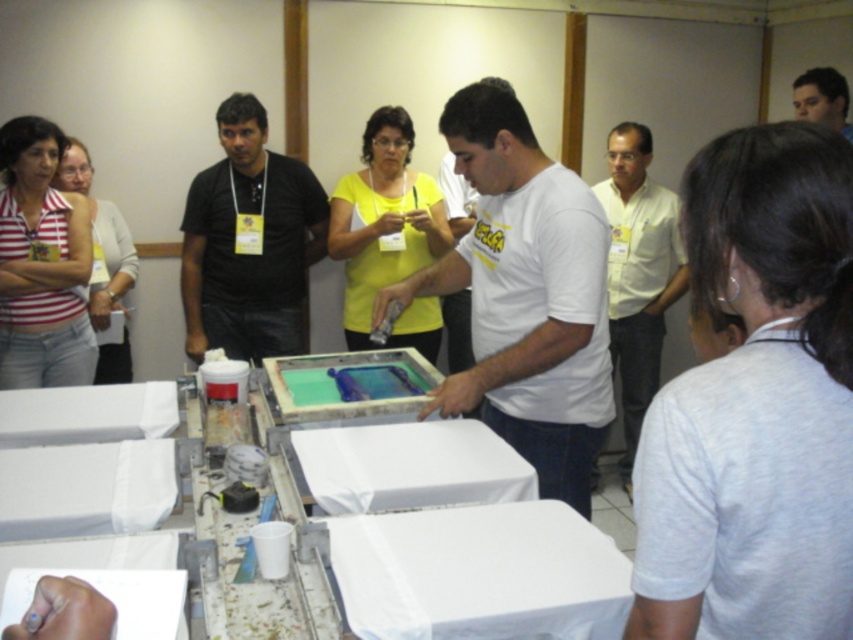
Is white matte t-shirt at center positioned at the back of white shirt at center?

No, white matte t-shirt at center is in front of white shirt at center.

Does white matte t-shirt at center have a larger size compared to white shirt at center?

No.

Locate an element on the screen. The image size is (853, 640). white matte t-shirt at center is located at coordinates (525, 296).

You are a GUI agent. You are given a task and a screenshot of the screen. Output one action in this format:
    pyautogui.click(x=<x>, y=<y>)
    Task: Click on the white matte t-shirt at center
    The width and height of the screenshot is (853, 640).
    Given the screenshot: What is the action you would take?
    pyautogui.click(x=525, y=296)

Is point (306, 397) in front of point (834, 108)?

Yes, point (306, 397) is closer to viewer.

Between translucent plastic tray at center and smooth skin face at upper right, which one appears on the right side from the viewer's perspective?

smooth skin face at upper right

At what (x,y) coordinates should I click in order to perform the action: click on translucent plastic tray at center. Please return your answer as a coordinate pair (x, y). Looking at the image, I should click on (352, 384).

Between point (305, 257) and point (447, 516), which one is positioned in front?

Positioned in front is point (447, 516).

Is black matte shirt at center shorter than white paper at center?

No.

What do you see at coordinates (248, 243) in the screenshot? I see `black matte shirt at center` at bounding box center [248, 243].

Locate an element on the screen. black matte shirt at center is located at coordinates (248, 243).